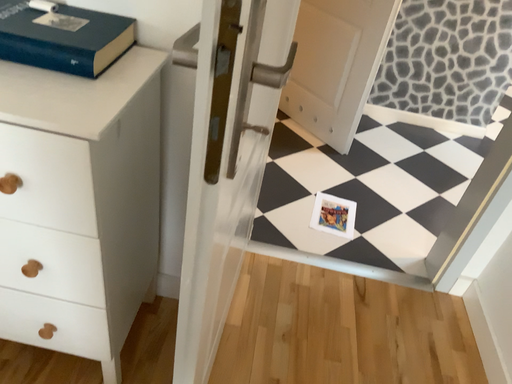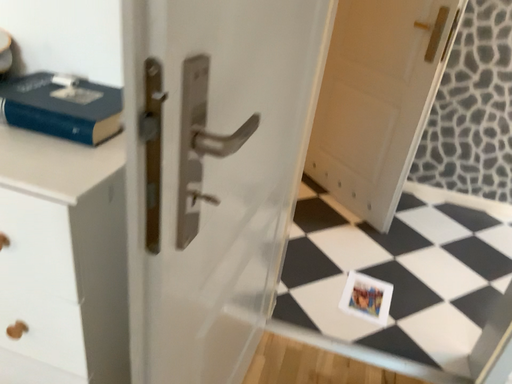
Question: How did the camera likely rotate when shooting the video?

Choices:
 (A) rotated downward
 (B) rotated upward

Answer: (B)